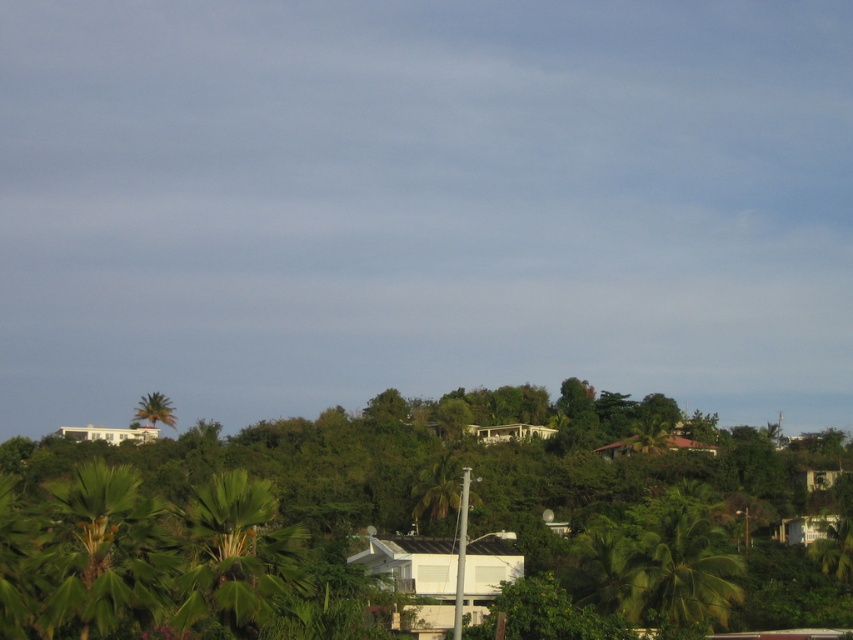
You are standing in the tropical landscape and want to take a photo of both the green leafy tree at lower right and the green leafy palm tree at upper left. Which tree should you focus on first if you want to include both in your frame without moving the camera?

You should focus on the green leafy palm tree at upper left first because it is taller than the green leafy tree at lower right, so it will occupy more space in the frame and ensure both are visible.

You are planning to install a new satellite dish on the highest point available in this area. Which tree between the green leafy tree at center and the green leafy tree at lower right would be the best option for mounting the dish?

The green leafy tree at center is much taller than the green leafy tree at lower right, so the green leafy tree at center would be the best option for mounting the satellite dish as it provides a higher elevation.

You are a bird looking for a nesting spot. You see the green leafy tree at center and the green leafy palm tree at upper left. Which tree is shorter and better for nesting?

The green leafy tree at center is shorter than the green leafy palm tree at upper left, making it better for nesting.